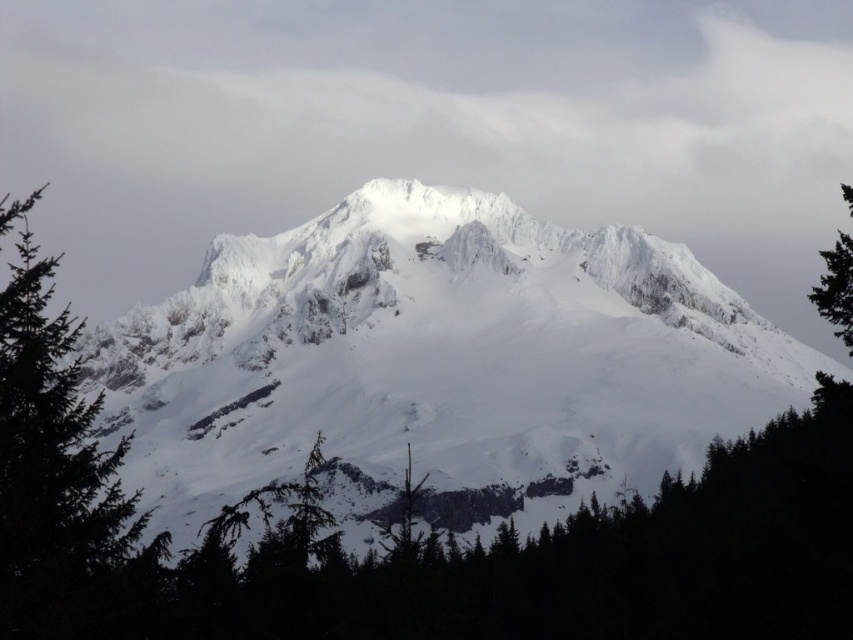
You are an environmental scientist assessing the health of the forest in the image. You observe the green matte tree at left and the green matte tree at right. Which tree has a wider canopy, and what might this indicate about its health?

The green matte tree at left has a wider canopy than the green matte tree at right. This could indicate that the tree at left is healthier, as wider canopies often suggest better health and access to resources like sunlight and nutrients.

You are a photographer standing at the base of the mountain. You want to capture a photo of the point at coordinates point [306,260]. Your camera has a maximum focus range of 200 meters. Will your camera be able to focus on that point?

The point [306,260] is 191.31 meters from the camera, which is within the maximum focus range of 200 meters. Therefore, the camera can focus on that point.